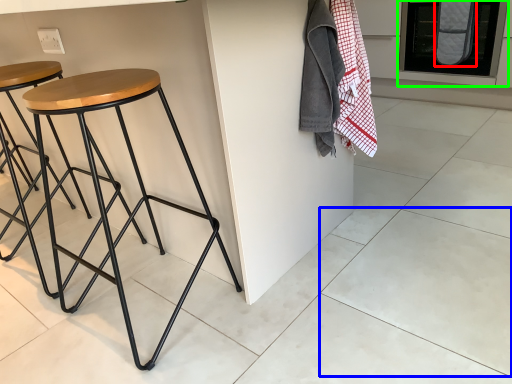
Question: Which is farther away from blanket (highlighted by a red box)? tile (highlighted by a blue box) or oven (highlighted by a green box)?

Choices:
 (A) tile
 (B) oven

Answer: (A)